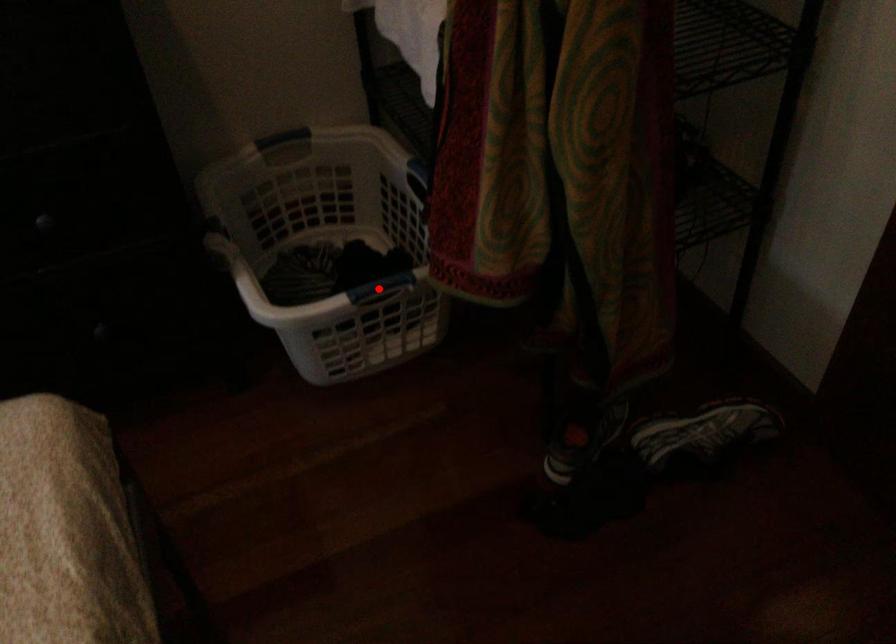
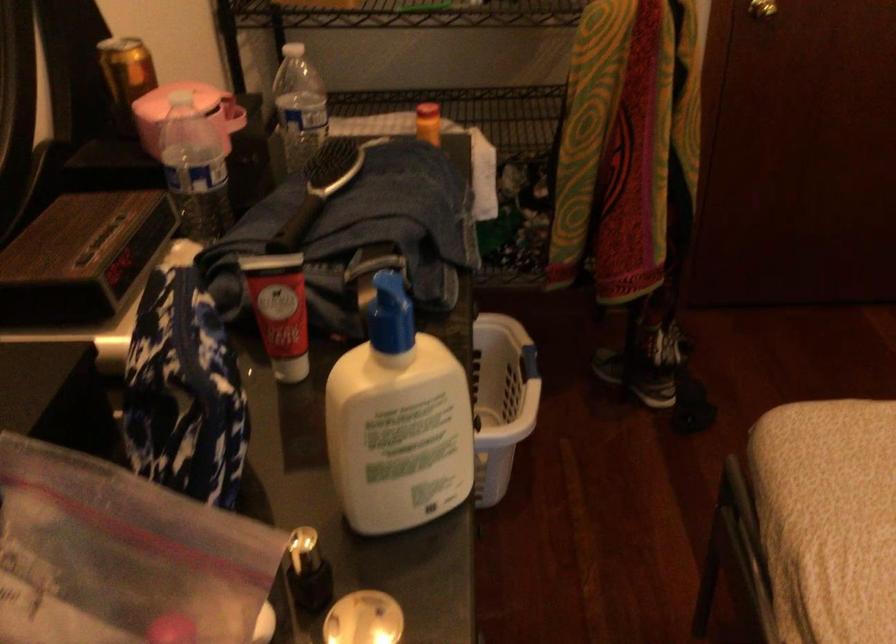
Question: I am providing you with two images of the same scene from different viewpoints. A red point is marked on the first image. Can you still see the location of the red point in image 2?

Choices:
 (A) Yes
 (B) No

Answer: (B)